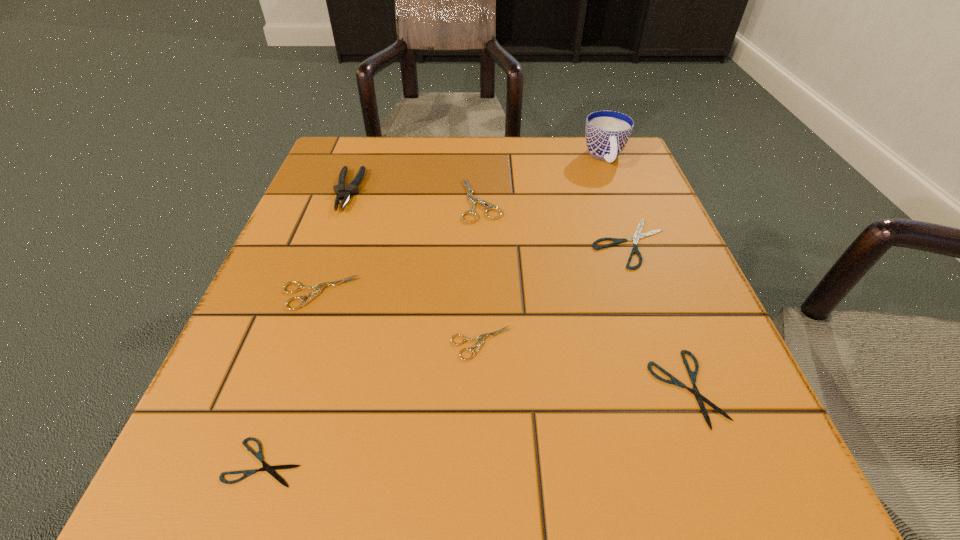
Where is `beige shears that is the second nearest to the second biggest black shears`? beige shears that is the second nearest to the second biggest black shears is located at coordinates (472, 200).

Select which beige shears appears as the second closest to the blue cup. Please provide its 2D coordinates. Your answer should be formatted as a tuple, i.e. [(x, y)], where the tuple contains the x and y coordinates of a point satisfying the conditions above.

[(480, 338)]

Find the location of `black shears that can be found as the second closest to the farthest black shears`. black shears that can be found as the second closest to the farthest black shears is located at coordinates (270, 469).

Identify which black shears is the second nearest to the farthest beige shears. Please provide its 2D coordinates. Your answer should be formatted as a tuple, i.e. [(x, y)], where the tuple contains the x and y coordinates of a point satisfying the conditions above.

[(692, 375)]

You are a GUI agent. You are given a task and a screenshot of the screen. Output one action in this format:
    pyautogui.click(x=<x>, y=<y>)
    Task: Click on the free space that satisfies the following two spatial constraints: 1. at the gripping part of the nearest beige shears; 2. on the left side of the gray pliers
    
    Given the screenshot: What is the action you would take?
    pyautogui.click(x=292, y=343)

At what (x,y) coordinates should I click in order to perform the action: click on blank space that satisfies the following two spatial constraints: 1. on the back side of the nearest black shears; 2. on the right side of the biggest black shears. Please return your answer as a coordinate pair (x, y). This screenshot has width=960, height=540. Looking at the image, I should click on (340, 244).

Locate an element on the screen. Image resolution: width=960 pixels, height=540 pixels. free space that satisfies the following two spatial constraints: 1. at the gripping part of the smallest beige shears; 2. on the right side of the seventh shortest object is located at coordinates (292, 343).